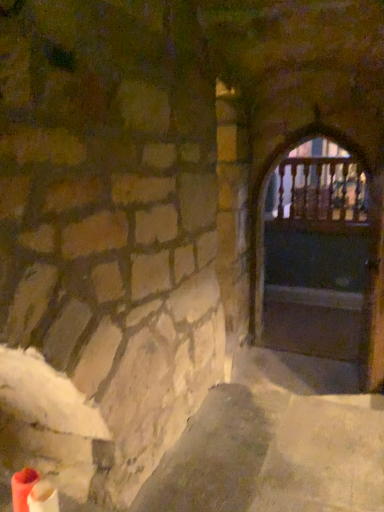
Question: Considering the relative sizes of wooden at right and wooden railing at center in the image provided, is wooden at right thinner than wooden railing at center?

Choices:
 (A) no
 (B) yes

Answer: (A)

Question: Could you tell me if wooden at right is turned towards wooden railing at center?

Choices:
 (A) yes
 (B) no

Answer: (B)

Question: Is wooden at right next to wooden railing at center?

Choices:
 (A) yes
 (B) no

Answer: (B)

Question: Is wooden at right further to camera compared to wooden railing at center?

Choices:
 (A) no
 (B) yes

Answer: (A)

Question: Is wooden at right at the right side of wooden railing at center?

Choices:
 (A) no
 (B) yes

Answer: (A)

Question: From the image's perspective, is wooden at right on top of wooden railing at center?

Choices:
 (A) no
 (B) yes

Answer: (A)

Question: Is wooden railing at center to the right of wooden at right from the viewer's perspective?

Choices:
 (A) no
 (B) yes

Answer: (B)

Question: From a real-world perspective, does wooden railing at center sit lower than wooden at right?

Choices:
 (A) no
 (B) yes

Answer: (A)

Question: Is wooden railing at center smaller than wooden at right?

Choices:
 (A) no
 (B) yes

Answer: (B)

Question: From the image's perspective, does wooden railing at center appear higher than wooden at right?

Choices:
 (A) no
 (B) yes

Answer: (B)

Question: Is wooden railing at center in contact with wooden at right?

Choices:
 (A) yes
 (B) no

Answer: (B)

Question: Is wooden railing at center shorter than wooden at right?

Choices:
 (A) yes
 (B) no

Answer: (A)

Question: From the image's perspective, is wooden railing at center positioned above or below wooden at right?

Choices:
 (A) above
 (B) below

Answer: (A)